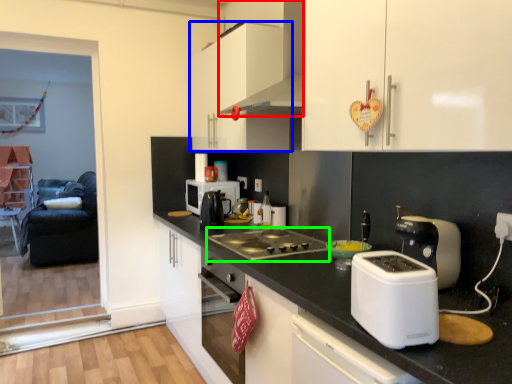
Question: Estimate the real-world distances between objects in this image. Which object is farther from home appliance (highlighted by a red box), cabinetry (highlighted by a blue box) or gas stove (highlighted by a green box)?

Choices:
 (A) cabinetry
 (B) gas stove

Answer: (B)